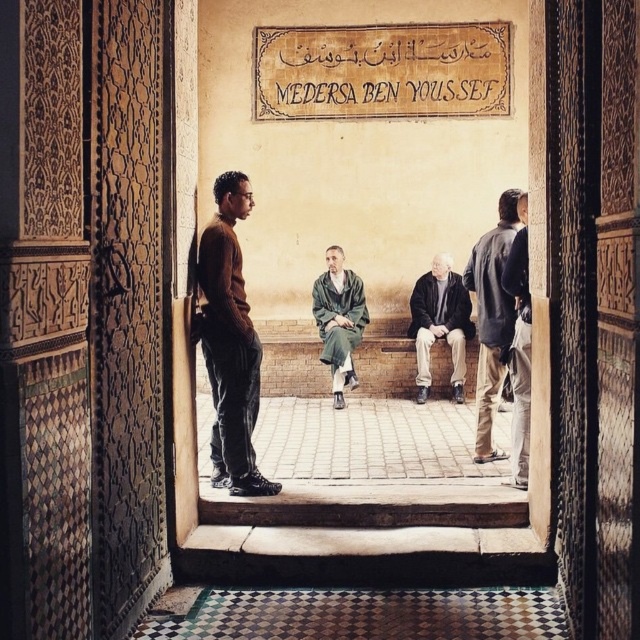
Question: Which point is closer to the camera taking this photo?

Choices:
 (A) (504, 268)
 (B) (344, 344)
 (C) (506, 324)
 (D) (252, 452)

Answer: (D)

Question: Which point appears farthest from the camera in this image?

Choices:
 (A) (422, 403)
 (B) (349, 324)
 (C) (486, 412)

Answer: (A)

Question: Is brown sweater at center further to camera compared to dark gray jacket at right?

Choices:
 (A) yes
 (B) no

Answer: (B)

Question: Does dark gray jacket at right have a lesser width compared to green textured robe at center?

Choices:
 (A) no
 (B) yes

Answer: (B)

Question: Can you confirm if green textured robe at center is thinner than dark brown leather jacket at right?

Choices:
 (A) no
 (B) yes

Answer: (A)

Question: Estimate the real-world distances between objects in this image. Which object is closer to the green textured robe at center?

Choices:
 (A) brown sweater at center
 (B) dark brown leather jacket at center
 (C) dark gray jacket at right

Answer: (B)